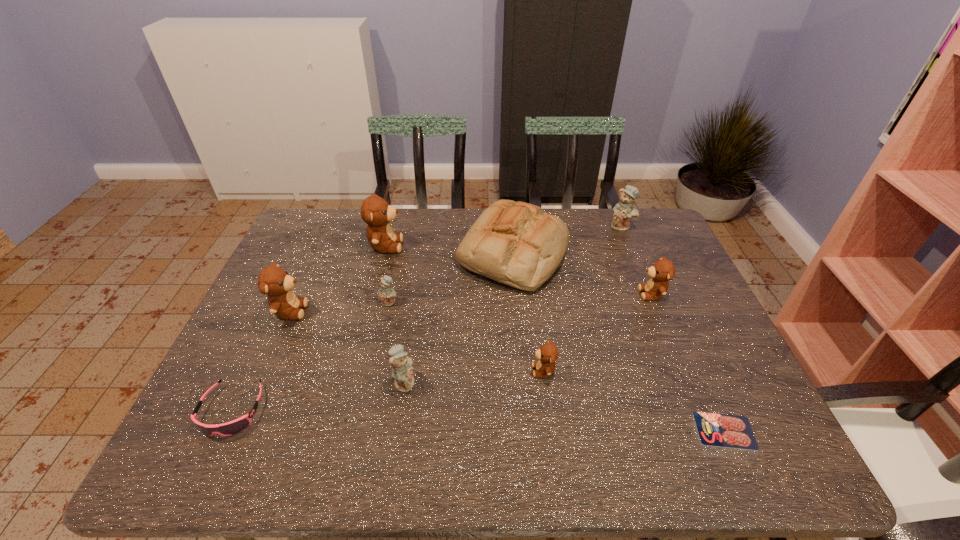
Identify the location of the tallest object. The height and width of the screenshot is (540, 960). (376, 212).

Where is `the sixth nearest teddy bear`? The width and height of the screenshot is (960, 540). the sixth nearest teddy bear is located at coordinates (376, 212).

Where is `bread`? The image size is (960, 540). bread is located at coordinates [x=517, y=244].

At what (x,y) coordinates should I click in order to perform the action: click on the farthest teddy bear. Please return your answer as a coordinate pair (x, y). The width and height of the screenshot is (960, 540). Looking at the image, I should click on (623, 211).

Locate an element on the screen. The image size is (960, 540). the biggest blue teddy bear is located at coordinates (623, 211).

At what (x,y) coordinates should I click in order to perform the action: click on the leftmost teddy bear. Please return your answer as a coordinate pair (x, y). Looking at the image, I should click on (274, 281).

The image size is (960, 540). Find the location of `the leftmost brown teddy bear`. the leftmost brown teddy bear is located at coordinates (274, 281).

I want to click on the rightmost brown teddy bear, so click(663, 270).

Find the location of a particular element. the second blue teddy bear from right to left is located at coordinates (401, 365).

At what (x,y) coordinates should I click in order to perform the action: click on the nearest blue teddy bear. Please return your answer as a coordinate pair (x, y). The image size is (960, 540). Looking at the image, I should click on (401, 365).